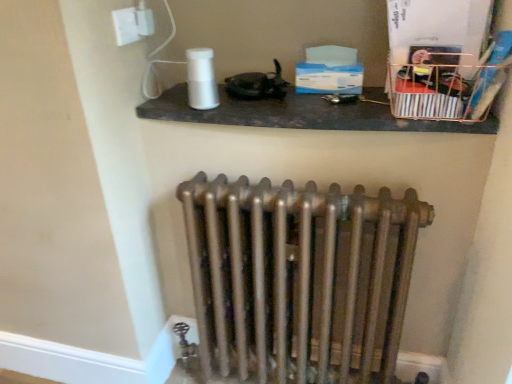
Question: Is white glossy electric outlet at upper left placed right next to bronze metallic radiator at center?

Choices:
 (A) yes
 (B) no

Answer: (B)

Question: Does white glossy electric outlet at upper left have a larger size compared to bronze metallic radiator at center?

Choices:
 (A) yes
 (B) no

Answer: (B)

Question: Considering the relative sizes of white glossy electric outlet at upper left and bronze metallic radiator at center in the image provided, is white glossy electric outlet at upper left smaller than bronze metallic radiator at center?

Choices:
 (A) yes
 (B) no

Answer: (A)

Question: Is white glossy electric outlet at upper left surrounding bronze metallic radiator at center?

Choices:
 (A) yes
 (B) no

Answer: (B)

Question: Does white glossy electric outlet at upper left turn towards bronze metallic radiator at center?

Choices:
 (A) no
 (B) yes

Answer: (A)

Question: From a real-world perspective, is bronze metallic radiator at center physically located above or below white glossy shelf at upper center?

Choices:
 (A) above
 (B) below

Answer: (B)

Question: From their relative heights in the image, would you say bronze metallic radiator at center is taller or shorter than white glossy shelf at upper center?

Choices:
 (A) tall
 (B) short

Answer: (A)

Question: From the image's perspective, is bronze metallic radiator at center above or below white glossy shelf at upper center?

Choices:
 (A) above
 (B) below

Answer: (B)

Question: Considering the relative positions of bronze metallic radiator at center and white glossy shelf at upper center in the image provided, is bronze metallic radiator at center to the left or to the right of white glossy shelf at upper center?

Choices:
 (A) right
 (B) left

Answer: (B)

Question: Is point (419, 92) closer or farther from the camera than point (117, 39)?

Choices:
 (A) closer
 (B) farther

Answer: (A)

Question: Looking at their shapes, would you say metallic wire basket at upper right is wider or thinner than white glossy electric outlet at upper left?

Choices:
 (A) thin
 (B) wide

Answer: (B)

Question: Do you think metallic wire basket at upper right is within white glossy electric outlet at upper left, or outside of it?

Choices:
 (A) inside
 (B) outside

Answer: (B)

Question: From their relative heights in the image, would you say metallic wire basket at upper right is taller or shorter than white glossy electric outlet at upper left?

Choices:
 (A) tall
 (B) short

Answer: (A)

Question: From a real-world perspective, is white glossy shelf at upper center above or below metallic wire basket at upper right?

Choices:
 (A) below
 (B) above

Answer: (A)

Question: Is white glossy shelf at upper center bigger or smaller than metallic wire basket at upper right?

Choices:
 (A) big
 (B) small

Answer: (A)